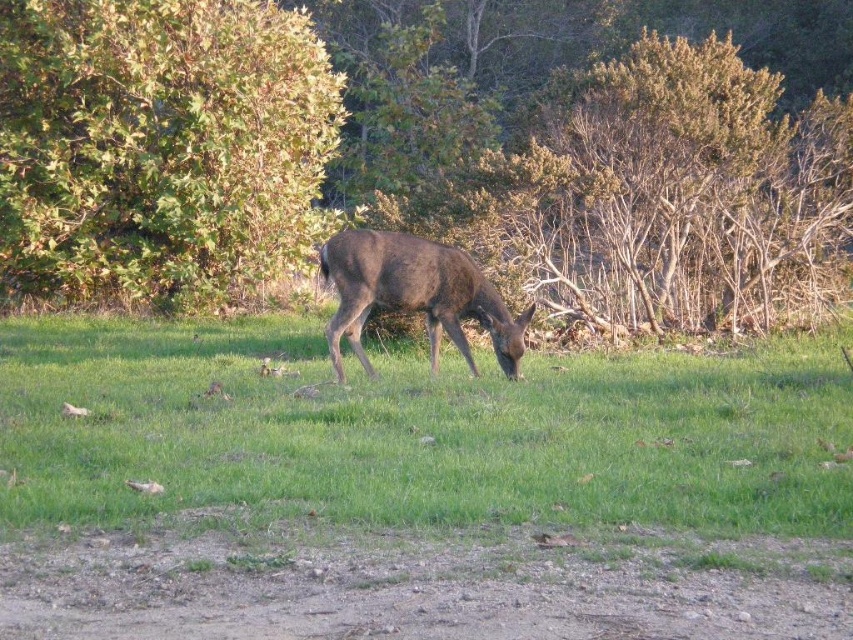
Question: Which object appears farthest from the camera in this image?

Choices:
 (A) brown matte deer at center
 (B) green leafy bush at upper left
 (C) green grassy at center
 (D) green leafy tree at upper left

Answer: (B)

Question: Is green leafy tree at upper left bigger than brown matte deer at center?

Choices:
 (A) yes
 (B) no

Answer: (A)

Question: Which point is farther from the camera taking this photo?

Choices:
 (A) (477, 305)
 (B) (759, 163)
 (C) (820, 369)
 (D) (314, 93)

Answer: (D)

Question: Can you confirm if green leafy tree at upper left is positioned above green leafy bush at upper left?

Choices:
 (A) yes
 (B) no

Answer: (A)

Question: Where is green leafy tree at upper left located in relation to green grassy at center in the image?

Choices:
 (A) right
 (B) left

Answer: (A)

Question: Which of the following is the closest to the observer?

Choices:
 (A) (70, 19)
 (B) (460, 365)
 (C) (550, 125)
 (D) (378, 266)

Answer: (D)